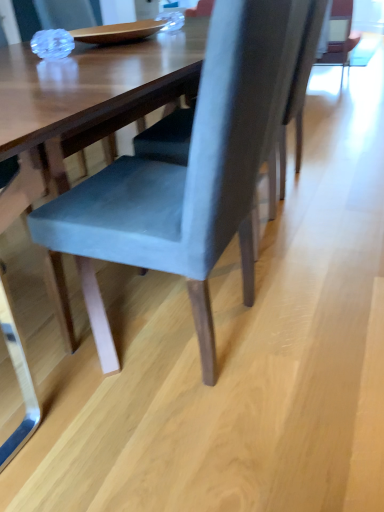
Find the location of a particular element. vacant point to the right of suede-like gray chair at center, the 2th chair viewed from the front is located at coordinates (324, 228).